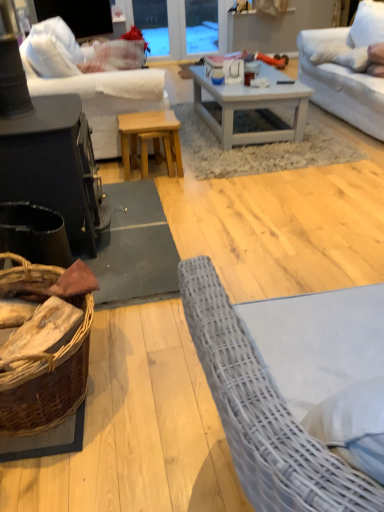
I want to click on white fabric couch at upper right, which is the second studio couch in left-to-right order, so click(346, 70).

Image resolution: width=384 pixels, height=512 pixels. I want to click on white wooden coffee table at center, so click(252, 106).

What is the approximate height of brown woven basket at lower left?

37.79 centimeters.

Measure the distance between black matte wood table at left, the first table viewed from the front, and camera.

The distance of black matte wood table at left, the first table viewed from the front, from camera is 1.68 meters.

This screenshot has width=384, height=512. What are the coordinates of `natural wood stool at center, the second table from the front` in the screenshot? It's located at (148, 131).

Identify the location of white fabric couch at upper right, which is the second studio couch in left-to-right order. (346, 70).

Based on the photo, between white fabric couch at upper right, which is the second studio couch in left-to-right order, and transparent glass door at upper center, which one has less height?

transparent glass door at upper center is shorter.

Does white fabric couch at upper right, the first studio couch positioned from the right, turn towards transparent glass door at upper center?

No, white fabric couch at upper right, the first studio couch positioned from the right, does not turn towards transparent glass door at upper center.

Is white fabric couch at upper right, which is the second studio couch in left-to-right order, positioned behind transparent glass door at upper center?

No, white fabric couch at upper right, which is the second studio couch in left-to-right order, is in front of transparent glass door at upper center.

Does white fabric couch at upper right, the first studio couch positioned from the right, have a lesser width compared to transparent glass door at upper center?

Incorrect, the width of white fabric couch at upper right, the first studio couch positioned from the right, is not less than that of transparent glass door at upper center.

Is natural wood stool at center, the second table from the front, at the back of white fabric couch at upper right, which is the second studio couch in left-to-right order?

No, white fabric couch at upper right, which is the second studio couch in left-to-right order,'s orientation is not away from natural wood stool at center, the second table from the front.

Is white fabric couch at upper right, which is the second studio couch in left-to-right order, wider or thinner than natural wood stool at center, the second table from the front?

white fabric couch at upper right, which is the second studio couch in left-to-right order, is wider than natural wood stool at center, the second table from the front.

Considering the relative sizes of white fabric couch at upper right, the first studio couch positioned from the right, and natural wood stool at center, positioned as the 1th table in back-to-front order, in the image provided, is white fabric couch at upper right, the first studio couch positioned from the right, shorter than natural wood stool at center, positioned as the 1th table in back-to-front order,?

Incorrect, the height of white fabric couch at upper right, the first studio couch positioned from the right, does not fall short of that of natural wood stool at center, positioned as the 1th table in back-to-front order.

From the image's perspective, who appears lower, white fabric couch at upper right, which is the second studio couch in left-to-right order, or natural wood stool at center, positioned as the 1th table in back-to-front order?

natural wood stool at center, positioned as the 1th table in back-to-front order, is shown below in the image.

Is the surface of transparent glass door at upper center in direct contact with white fabric couch at upper left, which is the 1th studio couch in left-to-right order?

There is a gap between transparent glass door at upper center and white fabric couch at upper left, which is the 1th studio couch in left-to-right order.

Can we say transparent glass door at upper center lies outside white fabric couch at upper left, which is the 1th studio couch in left-to-right order?

Yes, transparent glass door at upper center is not within white fabric couch at upper left, which is the 1th studio couch in left-to-right order.

From the image's perspective, is transparent glass door at upper center located above or below white fabric couch at upper left, the 2th studio couch when ordered from right to left?

transparent glass door at upper center is situated higher than white fabric couch at upper left, the 2th studio couch when ordered from right to left, in the image.

How many degrees apart are the facing directions of transparent glass door at upper center and white fabric couch at upper left, the 2th studio couch when ordered from right to left?

They differ by 88.9 degrees in their facing directions.

How far apart are black matte wood table at left, which appears as the second table when viewed from the back, and transparent glass door at upper center?

They are 12.65 feet apart.

Is black matte wood table at left, the first table viewed from the front, behind transparent glass door at upper center?

No, the depth of black matte wood table at left, the first table viewed from the front, is less than that of transparent glass door at upper center.

Who is taller, black matte wood table at left, which appears as the second table when viewed from the back, or transparent glass door at upper center?

Standing taller between the two is black matte wood table at left, which appears as the second table when viewed from the back.

Is black matte wood table at left, which appears as the second table when viewed from the back, facing away from transparent glass door at upper center?

No, transparent glass door at upper center is not at the back of black matte wood table at left, which appears as the second table when viewed from the back.

Can you confirm if transparent glass door at upper center is wider than black matte wood table at left, which appears as the second table when viewed from the back?

Incorrect, the width of transparent glass door at upper center does not surpass that of black matte wood table at left, which appears as the second table when viewed from the back.

Is transparent glass door at upper center to the right of black matte wood table at left, the first table viewed from the front, from the viewer's perspective?

Indeed, transparent glass door at upper center is positioned on the right side of black matte wood table at left, the first table viewed from the front.

Can you tell me how much transparent glass door at upper center and black matte wood table at left, which appears as the second table when viewed from the back, differ in facing direction?

transparent glass door at upper center and black matte wood table at left, which appears as the second table when viewed from the back, are facing 88.9 degrees away from each other.

Is natural wood stool at center, the second table from the front, directly adjacent to white fabric couch at upper left, the 2th studio couch when ordered from right to left?

No, natural wood stool at center, the second table from the front, is not with white fabric couch at upper left, the 2th studio couch when ordered from right to left.

Considering the relative sizes of natural wood stool at center, the second table from the front, and white fabric couch at upper left, the 2th studio couch when ordered from right to left, in the image provided, is natural wood stool at center, the second table from the front, smaller than white fabric couch at upper left, the 2th studio couch when ordered from right to left,?

Yes, natural wood stool at center, the second table from the front, is smaller than white fabric couch at upper left, the 2th studio couch when ordered from right to left.

What's the angular difference between natural wood stool at center, the second table from the front, and white fabric couch at upper left, the 2th studio couch when ordered from right to left,'s facing directions?

The facing directions of natural wood stool at center, the second table from the front, and white fabric couch at upper left, the 2th studio couch when ordered from right to left, are 8.75e-06 degrees apart.

Is natural wood stool at center, the second table from the front, looking in the opposite direction of white fabric couch at upper left, which is the 1th studio couch in left-to-right order?

No, natural wood stool at center, the second table from the front,'s orientation is not away from white fabric couch at upper left, which is the 1th studio couch in left-to-right order.

Can you tell me how much black matte wood table at left, the first table viewed from the front, and white fabric couch at upper left, which is the 1th studio couch in left-to-right order, differ in facing direction?

There is a 1.76e-05-degree angle between the facing directions of black matte wood table at left, the first table viewed from the front, and white fabric couch at upper left, which is the 1th studio couch in left-to-right order.

Which is in front, point (44, 201) or point (113, 101)?

The point (44, 201) is more forward.

Considering the relative sizes of black matte wood table at left, the first table viewed from the front, and white fabric couch at upper left, which is the 1th studio couch in left-to-right order, in the image provided, is black matte wood table at left, the first table viewed from the front, thinner than white fabric couch at upper left, which is the 1th studio couch in left-to-right order,?

Yes.

Between black matte wood table at left, which appears as the second table when viewed from the back, and white fabric couch at upper left, which is the 1th studio couch in left-to-right order, which one appears on the right side from the viewer's perspective?

black matte wood table at left, which appears as the second table when viewed from the back.

This screenshot has width=384, height=512. What are the coordinates of `glass door above the white fabric couch at upper right, the first studio couch positioned from the right (from a real-world perspective)` in the screenshot? It's located at (180, 26).

There is a natural wood stool at center, positioned as the 1th table in back-to-front order. Find the location of `the 2nd studio couch above it (from the image's perspective)`. the 2nd studio couch above it (from the image's perspective) is located at coordinates (346, 70).

Estimate the real-world distances between objects in this image. Which object is further from black matte wood table at left, the first table viewed from the front, white fabric couch at upper right, which is the second studio couch in left-to-right order, or brown woven basket at lower left?

Based on the image, white fabric couch at upper right, which is the second studio couch in left-to-right order, appears to be further to black matte wood table at left, the first table viewed from the front.

Looking at the image, which one is located further to black matte wood table at left, the first table viewed from the front, white wooden coffee table at center or white fabric couch at upper left, the 2th studio couch when ordered from right to left?

white wooden coffee table at center.

From the image, which object appears to be nearer to brown woven basket at lower left, black matte wood table at left, which appears as the second table when viewed from the back, or white fabric couch at upper left, which is the 1th studio couch in left-to-right order?

Based on the image, black matte wood table at left, which appears as the second table when viewed from the back, appears to be nearer to brown woven basket at lower left.

Looking at the image, which one is located further to natural wood stool at center, the second table from the front, black matte wood table at left, the first table viewed from the front, or white fabric couch at upper left, which is the 1th studio couch in left-to-right order?

black matte wood table at left, the first table viewed from the front.

Estimate the real-world distances between objects in this image. Which object is closer to transparent glass door at upper center, brown woven basket at lower left or black matte wood table at left, the first table viewed from the front?

black matte wood table at left, the first table viewed from the front, is closer to transparent glass door at upper center.

Based on their spatial positions, is transparent glass door at upper center or white wooden coffee table at center closer to white fabric couch at upper right, the first studio couch positioned from the right?

Based on the image, white wooden coffee table at center appears to be nearer to white fabric couch at upper right, the first studio couch positioned from the right.

Looking at the image, which one is located closer to brown woven basket at lower left, natural wood stool at center, positioned as the 1th table in back-to-front order, or white fabric couch at upper left, the 2th studio couch when ordered from right to left?

natural wood stool at center, positioned as the 1th table in back-to-front order, is positioned closer to the anchor brown woven basket at lower left.

Based on their spatial positions, is brown woven basket at lower left or natural wood stool at center, the second table from the front, further from white wooden coffee table at center?

Based on the image, brown woven basket at lower left appears to be further to white wooden coffee table at center.

Where is `basket between white fabric couch at upper left, the 2th studio couch when ordered from right to left, and white fabric couch at upper right, which is the second studio couch in left-to-right order, from left to right`? basket between white fabric couch at upper left, the 2th studio couch when ordered from right to left, and white fabric couch at upper right, which is the second studio couch in left-to-right order, from left to right is located at coordinates (48, 382).

The width and height of the screenshot is (384, 512). I want to click on basket between black matte wood table at left, the first table viewed from the front, and white fabric couch at upper right, the first studio couch positioned from the right, from left to right, so click(x=48, y=382).

This screenshot has height=512, width=384. What are the coordinates of `table located between black matte wood table at left, the first table viewed from the front, and white fabric couch at upper right, the first studio couch positioned from the right, in the left-right direction` in the screenshot? It's located at (148, 131).

What are the coordinates of `table between brown woven basket at lower left and natural wood stool at center, the second table from the front, from front to back` in the screenshot? It's located at (54, 165).